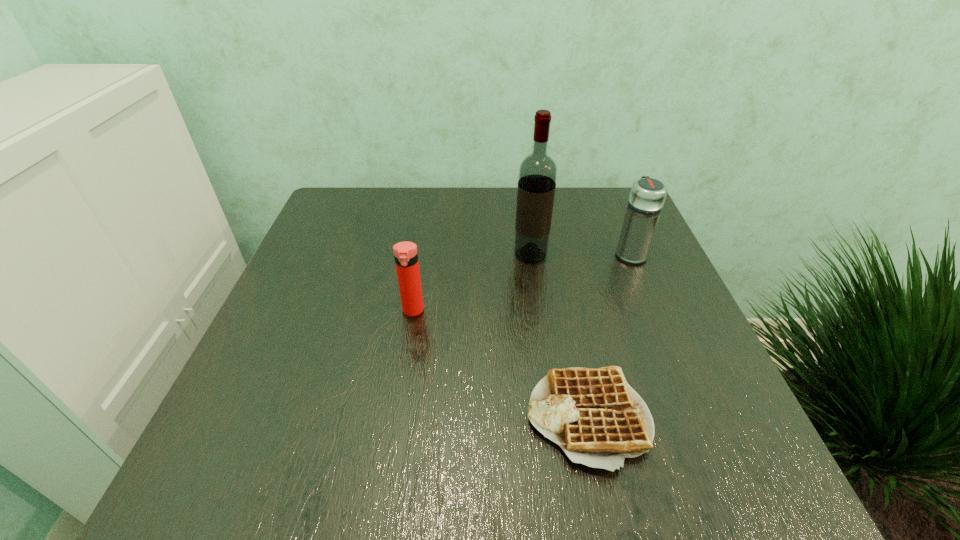
In the image, there is a desktop. Where is `free space at the right edge`? free space at the right edge is located at coordinates (686, 418).

At what (x,y) coordinates should I click in order to perform the action: click on unoccupied position between the nearest object and the wine bottle. Please return your answer as a coordinate pair (x, y). Image resolution: width=960 pixels, height=540 pixels. Looking at the image, I should click on (560, 336).

What are the coordinates of `free space between the waffle and the third farthest object` in the screenshot? It's located at (501, 364).

Find the location of a particular element. The image size is (960, 540). vacant space that is in between the left thermos bottle and the tallest object is located at coordinates (471, 283).

The height and width of the screenshot is (540, 960). In order to click on free spot between the left thermos bottle and the farther thermos bottle in this screenshot , I will do `click(521, 282)`.

Find the location of a particular element. free space between the left thermos bottle and the waffle is located at coordinates [501, 364].

You are a GUI agent. You are given a task and a screenshot of the screen. Output one action in this format:
    pyautogui.click(x=<x>, y=<y>)
    Task: Click on the unoccupied position between the nearer thermos bottle and the right thermos bottle
    This screenshot has width=960, height=540.
    Given the screenshot: What is the action you would take?
    pyautogui.click(x=521, y=282)

Identify the location of free space between the wine bottle and the farther thermos bottle. (580, 254).

Find the location of a particular element. unoccupied area between the left thermos bottle and the tallest object is located at coordinates (471, 283).

You are a GUI agent. You are given a task and a screenshot of the screen. Output one action in this format:
    pyautogui.click(x=<x>, y=<y>)
    Task: Click on the free space between the wine bottle and the shortest object
    
    Given the screenshot: What is the action you would take?
    pyautogui.click(x=560, y=336)